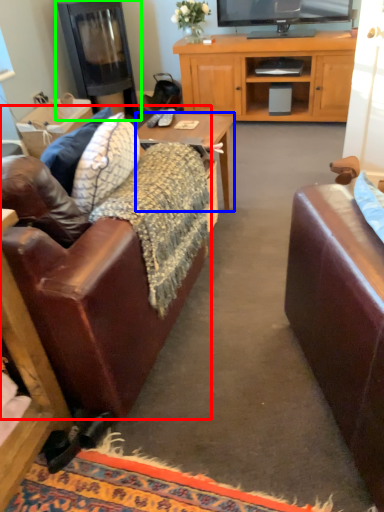
Question: Based on their relative distances, which object is farther from studio couch (highlighted by a red box)? Choose from desk (highlighted by a blue box) and fireplace (highlighted by a green box).

Choices:
 (A) desk
 (B) fireplace

Answer: (B)